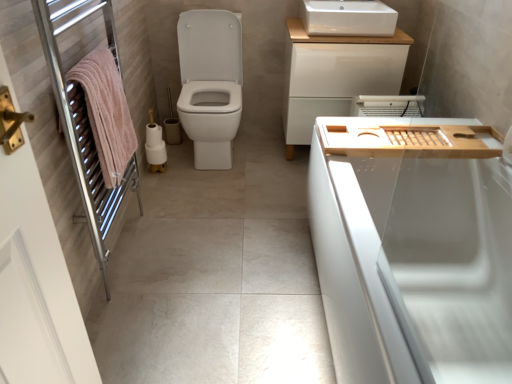
This screenshot has width=512, height=384. Describe the element at coordinates (335, 75) in the screenshot. I see `white matte cabinet at upper center` at that location.

You are a GUI agent. You are given a task and a screenshot of the screen. Output one action in this format:
    pyautogui.click(x=<x>, y=<y>)
    Task: Click on the pink soft towel at left
    
    Given the screenshot: What is the action you would take?
    pyautogui.click(x=106, y=112)

Locate an element on the screen. This screenshot has height=384, width=512. white matte cabinet at upper center is located at coordinates (335, 75).

Is white matte toilet paper at center behind pink soft towel at left?

Yes, it is.

Measure the distance between white matte toilet paper at center and pink soft towel at left.

white matte toilet paper at center is 30.78 inches away from pink soft towel at left.

From a real-world perspective, is white matte toilet paper at center positioned over pink soft towel at left based on gravity?

No, from a real-world perspective, white matte toilet paper at center is not over pink soft towel at left

In the scene shown: Does white glossy toilet at center turn towards pink soft towel at left?

Yes, white glossy toilet at center is aimed at pink soft towel at left.

From the image's perspective, is white glossy toilet at center above or below pink soft towel at left?

From the image's perspective, white glossy toilet at center appears above pink soft towel at left.

Is white glossy toilet at center inside the boundaries of pink soft towel at left, or outside?

white glossy toilet at center is located beyond the bounds of pink soft towel at left.

From the picture: Between white glossy toilet at center and pink soft towel at left, which one has smaller width?

pink soft towel at left is thinner.

Is white ceramic sink at upper center positioned far away from pink soft towel at left?

Indeed, white ceramic sink at upper center is not near pink soft towel at left.

Who is taller, white ceramic sink at upper center or pink soft towel at left?

Standing taller between the two is pink soft towel at left.

Considering the relative sizes of white ceramic sink at upper center and pink soft towel at left in the image provided, is white ceramic sink at upper center wider than pink soft towel at left?

Correct, the width of white ceramic sink at upper center exceeds that of pink soft towel at left.

Is white ceramic sink at upper center bigger or smaller than pink soft towel at left?

Considering their sizes, white ceramic sink at upper center takes up more space than pink soft towel at left.

Which object is positioned more to the right, white ceramic sink at upper center or wooden tray at right?

From the viewer's perspective, wooden tray at right appears more on the right side.

From a real-world perspective, who is located higher, white ceramic sink at upper center or wooden tray at right?

white ceramic sink at upper center, from a real-world perspective.

Between white ceramic sink at upper center and wooden tray at right, which one has less height?

wooden tray at right is shorter.

Consider the image. Can you tell me how much white glossy bathtub at right and white matte cabinet at upper center differ in facing direction?

They differ by 90 degrees in their facing directions.

Is white glossy bathtub at right not inside white matte cabinet at upper center?

white glossy bathtub at right lies outside white matte cabinet at upper center's area.

Considering the relative sizes of white glossy bathtub at right and white matte cabinet at upper center in the image provided, is white glossy bathtub at right taller than white matte cabinet at upper center?

No.

I want to click on bath lying in front of the white matte cabinet at upper center, so click(x=413, y=248).

Which of these two, white matte toilet paper at center or pink towel at left, stands shorter?

With less height is white matte toilet paper at center.

Is white matte toilet paper at center far from pink towel at left?

No, white matte toilet paper at center is in close proximity to pink towel at left.

Which point is more distant from viewer, (161, 131) or (72, 86)?

Positioned behind is point (161, 131).

From a real-world perspective, is wooden tray at right located beneath white glossy bathtub at right?

No, from a real-world perspective, wooden tray at right is not below white glossy bathtub at right.

From their relative heights in the image, would you say wooden tray at right is taller or shorter than white glossy bathtub at right?

In the image, wooden tray at right appears to be shorter than white glossy bathtub at right.

Considering the relative positions of wooden tray at right and white glossy bathtub at right in the image provided, is wooden tray at right behind white glossy bathtub at right?

Yes, wooden tray at right is further from the viewer.

The width and height of the screenshot is (512, 384). I want to click on bath towel in front of the white matte toilet paper at center, so click(x=106, y=112).

Identify the location of bath towel on the left of white glossy toilet at center. This screenshot has height=384, width=512. (106, 112).

Based on their spatial positions, is white matte toilet paper at center or white ceramic sink at upper center closer to pink towel at left?

white matte toilet paper at center.

Looking at the image, which one is located closer to pink soft towel at left, white ceramic sink at upper center or white glossy bathtub at right?

white glossy bathtub at right lies closer to pink soft towel at left than the other object.

Which object lies nearer to the anchor point white glossy toilet at center, white ceramic sink at upper center or pink soft towel at left?

The object closer to white glossy toilet at center is white ceramic sink at upper center.

Which object lies further to the anchor point white ceramic sink at upper center, pink soft towel at left or white matte cabinet at upper center?

pink soft towel at left lies further to white ceramic sink at upper center than the other object.

Based on their spatial positions, is white matte toilet paper at center or wooden tray at right further from white glossy bathtub at right?

Among the two, white matte toilet paper at center is located further to white glossy bathtub at right.

Looking at the image, which one is located closer to white matte cabinet at upper center, pink towel at left or white ceramic sink at upper center?

white ceramic sink at upper center is closer to white matte cabinet at upper center.

Based on their spatial positions, is white ceramic sink at upper center or white glossy toilet at center closer to pink towel at left?

white glossy toilet at center.

Considering their positions, is pink towel at left positioned closer to white glossy bathtub at right than wooden tray at right?

The object closer to white glossy bathtub at right is wooden tray at right.

What are the coordinates of `toilet between pink towel at left and white matte cabinet at upper center in the front-back direction` in the screenshot? It's located at (210, 84).

I want to click on counter top located between pink soft towel at left and white glossy bathtub at right in the left-right direction, so click(407, 138).

Where is `counter top situated between pink towel at left and white glossy bathtub at right from left to right`? This screenshot has height=384, width=512. counter top situated between pink towel at left and white glossy bathtub at right from left to right is located at coordinates (407, 138).

The width and height of the screenshot is (512, 384). I want to click on screen door located between white glossy bathtub at right and white glossy toilet at center in the depth direction, so click(x=85, y=125).